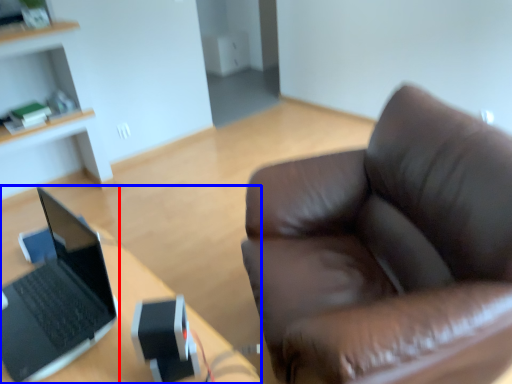
Question: Which of the following is the farthest to the observer, laptop (highlighted by a red box) or desk (highlighted by a blue box)?

Choices:
 (A) laptop
 (B) desk

Answer: (A)